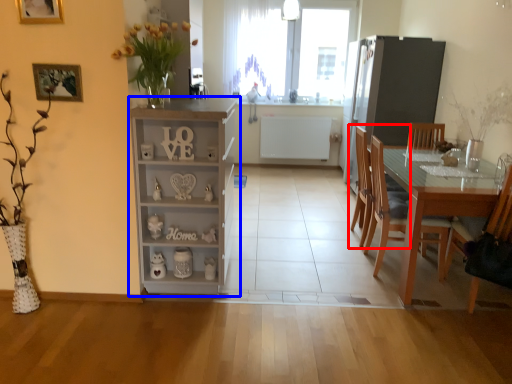
Question: Which of the following is the farthest to the observer, chair (highlighted by a red box) or cabinetry (highlighted by a blue box)?

Choices:
 (A) chair
 (B) cabinetry

Answer: (A)